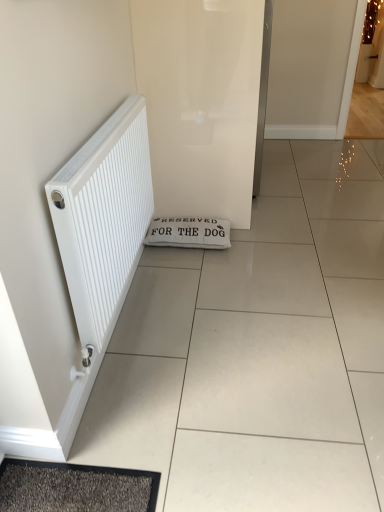
Question: From the image's perspective, is white matte radiator at left below white glossy screen door at center?

Choices:
 (A) no
 (B) yes

Answer: (B)

Question: Does white matte radiator at left appear on the left side of white glossy screen door at center?

Choices:
 (A) no
 (B) yes

Answer: (B)

Question: Is there a large distance between white matte radiator at left and white glossy screen door at center?

Choices:
 (A) no
 (B) yes

Answer: (A)

Question: Can you confirm if white matte radiator at left is positioned to the right of white glossy screen door at center?

Choices:
 (A) no
 (B) yes

Answer: (A)

Question: Considering the relative positions of white matte radiator at left and white glossy screen door at center in the image provided, is white matte radiator at left in front of white glossy screen door at center?

Choices:
 (A) no
 (B) yes

Answer: (B)

Question: Looking at the image, does white fabric doormat at center seem bigger or smaller compared to white glossy screen door at center?

Choices:
 (A) big
 (B) small

Answer: (B)

Question: Visually, is white fabric doormat at center positioned to the left or to the right of white glossy screen door at center?

Choices:
 (A) left
 (B) right

Answer: (A)

Question: From their relative heights in the image, would you say white fabric doormat at center is taller or shorter than white glossy screen door at center?

Choices:
 (A) short
 (B) tall

Answer: (A)

Question: From a real-world perspective, is white fabric doormat at center positioned above or below white glossy screen door at center?

Choices:
 (A) below
 (B) above

Answer: (A)

Question: Considering the positions of white matte radiator at left and white fabric doormat at center in the image, is white matte radiator at left taller or shorter than white fabric doormat at center?

Choices:
 (A) short
 (B) tall

Answer: (B)

Question: Is white matte radiator at left wider or thinner than white fabric doormat at center?

Choices:
 (A) wide
 (B) thin

Answer: (B)

Question: From the image's perspective, is white matte radiator at left above or below white fabric doormat at center?

Choices:
 (A) above
 (B) below

Answer: (A)

Question: Is white matte radiator at left inside the boundaries of white fabric doormat at center, or outside?

Choices:
 (A) outside
 (B) inside

Answer: (A)

Question: From the image's perspective, is white glossy screen door at center located above or below white matte radiator at left?

Choices:
 (A) below
 (B) above

Answer: (B)

Question: Does point (208, 146) appear closer or farther from the camera than point (144, 202)?

Choices:
 (A) farther
 (B) closer

Answer: (A)